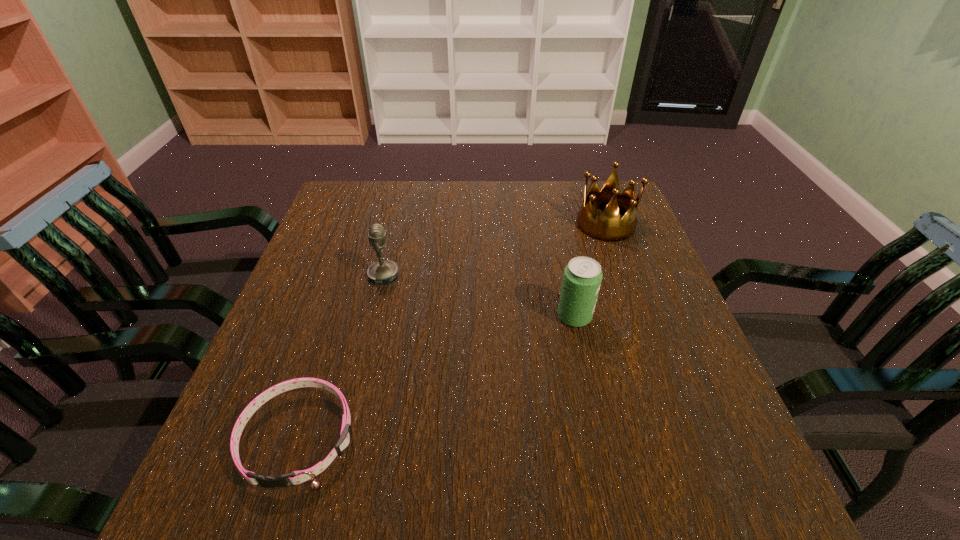
In order to click on object that can be found as the third closest to the microphone in this screenshot , I will do `click(608, 227)`.

This screenshot has width=960, height=540. What are the coordinates of `object that ranks as the third closest to the shortest object` in the screenshot? It's located at (608, 227).

Locate an element on the screen. vacant point that satisfies the following two spatial constraints: 1. on the front-facing side of the third nearest object; 2. on the right side of the second nearest object is located at coordinates (373, 316).

You are a GUI agent. You are given a task and a screenshot of the screen. Output one action in this format:
    pyautogui.click(x=<x>, y=<y>)
    Task: Click on the vacant position in the image that satisfies the following two spatial constraints: 1. on the back side of the second nearest object; 2. on the front-facing side of the microphone
    
    Given the screenshot: What is the action you would take?
    pyautogui.click(x=565, y=275)

Where is `vacant region that satisfies the following two spatial constraints: 1. on the front-facing side of the third nearest object; 2. on the left side of the second object from right to left`? This screenshot has width=960, height=540. vacant region that satisfies the following two spatial constraints: 1. on the front-facing side of the third nearest object; 2. on the left side of the second object from right to left is located at coordinates (373, 316).

This screenshot has width=960, height=540. In order to click on free space that satisfies the following two spatial constraints: 1. on the front-facing side of the microphone; 2. on the back side of the soda in this screenshot , I will do pos(373,316).

What are the coordinates of `free location that satisfies the following two spatial constraints: 1. on the front-facing side of the third nearest object; 2. with the buckle on the shortest object` in the screenshot? It's located at pos(345,438).